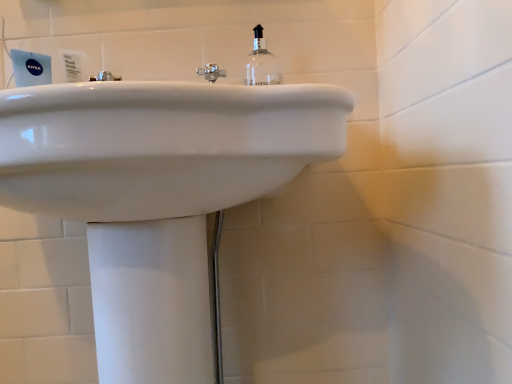
Identify the location of white glossy sink at center. (157, 194).

Based on the photo, what is the approximate width of white glossy sink at center?

white glossy sink at center is 18.22 inches wide.

This screenshot has width=512, height=384. Describe the element at coordinates (157, 194) in the screenshot. I see `white glossy sink at center` at that location.

Where is `white glossy sink at center`? The width and height of the screenshot is (512, 384). white glossy sink at center is located at coordinates (157, 194).